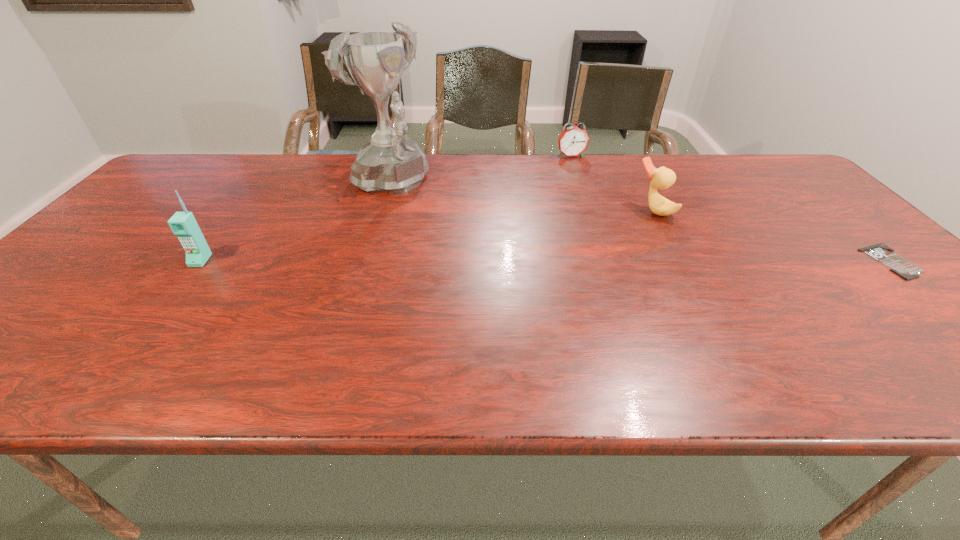
The width and height of the screenshot is (960, 540). In order to click on blank area in the image that satisfies the following two spatial constraints: 1. on the back side of the award; 2. on the right side of the third object from right to left in this screenshot , I will do `click(398, 156)`.

Image resolution: width=960 pixels, height=540 pixels. Find the location of `free spot that satisfies the following two spatial constraints: 1. on the front side of the duck; 2. on the left side of the rightmost object`. free spot that satisfies the following two spatial constraints: 1. on the front side of the duck; 2. on the left side of the rightmost object is located at coordinates (683, 261).